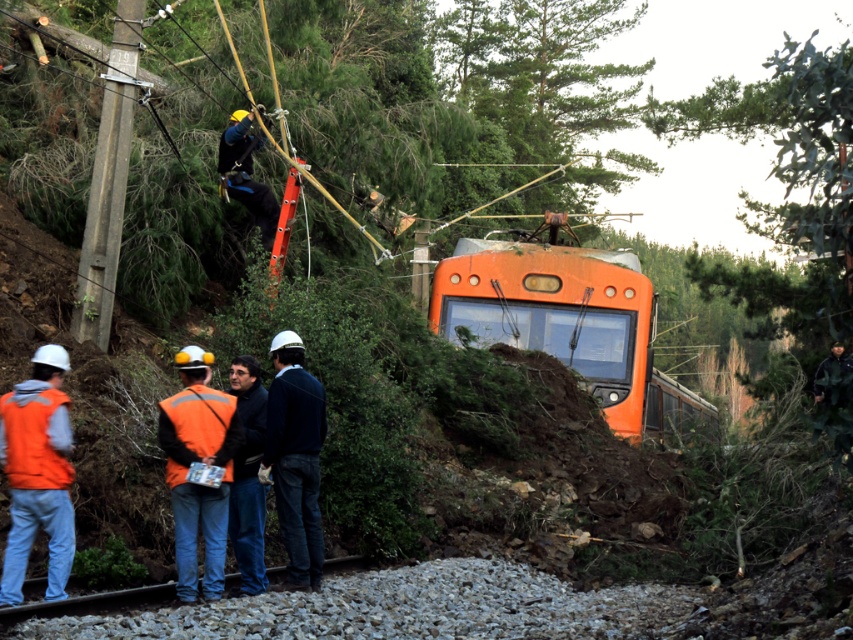
Can you confirm if green leafy tree at upper center is positioned above orange reflective vest at lower left?

Yes.

Between point (445, 204) and point (56, 497), which one is positioned behind?

The point (445, 204) is behind.

Locate an element on the screen. The height and width of the screenshot is (640, 853). green leafy tree at upper center is located at coordinates (544, 88).

Identify the location of green leafy tree at upper center. Image resolution: width=853 pixels, height=640 pixels. tap(544, 88).

Based on the photo, between green leafy tree at upper center and orange matte train at center, which one has more height?

With more height is green leafy tree at upper center.

Locate an element on the screen. The height and width of the screenshot is (640, 853). green leafy tree at upper center is located at coordinates (544, 88).

Locate an element on the screen. The image size is (853, 640). green leafy tree at upper center is located at coordinates (544, 88).

Who is positioned more to the left, orange matte train at center or dark blue jeans at center?

dark blue jeans at center is more to the left.

Which is in front, point (480, 342) or point (299, 579)?

Point (299, 579) is more forward.

Describe the element at coordinates (567, 323) in the screenshot. I see `orange matte train at center` at that location.

The height and width of the screenshot is (640, 853). Identify the location of orange matte train at center. (567, 323).